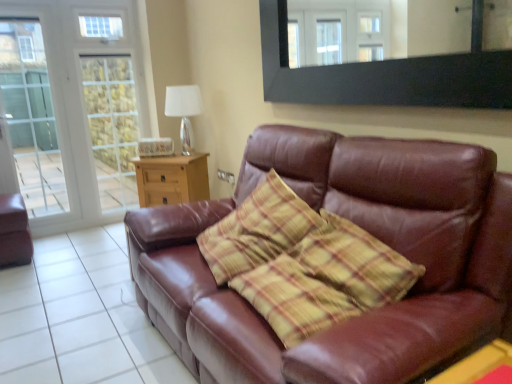
Question: Looking at the image, does black matte mirror at upper center seem bigger or smaller compared to brown leather couch at lower right?

Choices:
 (A) big
 (B) small

Answer: (B)

Question: Considering their positions, is black matte mirror at upper center located in front of or behind brown leather couch at lower right?

Choices:
 (A) front
 (B) behind

Answer: (A)

Question: Estimate the real-world distances between objects in this image. Which object is closer to the black matte mirror at upper center?

Choices:
 (A) brown leather couch at center
 (B) matte brown leather armchair at left
 (C) clear glass screen door at left
 (D) yellow plastic table at lower right, positioned as the 2th table in top-to-bottom order
 (E) brown leather couch at lower right

Answer: (A)

Question: Based on their relative distances, which object is farther from the wooden side table at center, the 2th table positioned from the front?

Choices:
 (A) brown leather couch at center
 (B) yellow plastic table at lower right, positioned as the 2th table in top-to-bottom order
 (C) black matte mirror at upper center
 (D) clear glass screen door at left
 (E) matte brown leather armchair at left

Answer: (B)